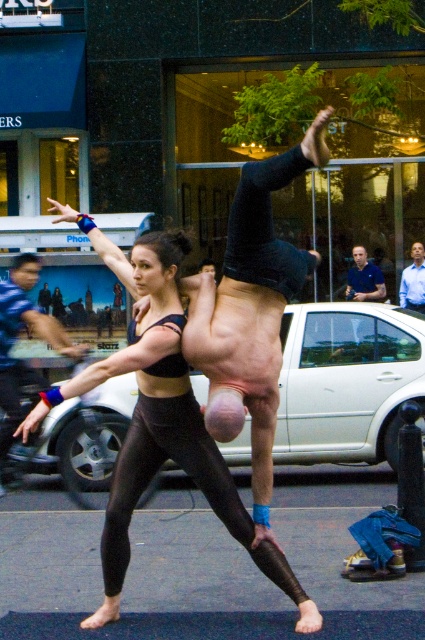
Question: Which object appears closest to the camera in this image?

Choices:
 (A) matte black tank top at center
 (B) blue shirt at upper right
 (C) blue shirt at center

Answer: (A)

Question: Among these objects, which one is farthest from the camera?

Choices:
 (A) black matte leggings at center
 (B) matte black tank top at center
 (C) blue shirt at upper right

Answer: (C)

Question: Which of these objects is positioned farthest from the blue shirt at center?

Choices:
 (A) blue shirt at upper right
 (B) matte black tank top at center
 (C) black matte leggings at center

Answer: (C)

Question: Is matte black tank top at center below blue shirt at center?

Choices:
 (A) no
 (B) yes

Answer: (B)

Question: Is blue shirt at center thinner than blue shirt at upper right?

Choices:
 (A) no
 (B) yes

Answer: (A)

Question: Can you confirm if black matte leggings at center is positioned below matte black tank top at center?

Choices:
 (A) no
 (B) yes

Answer: (B)